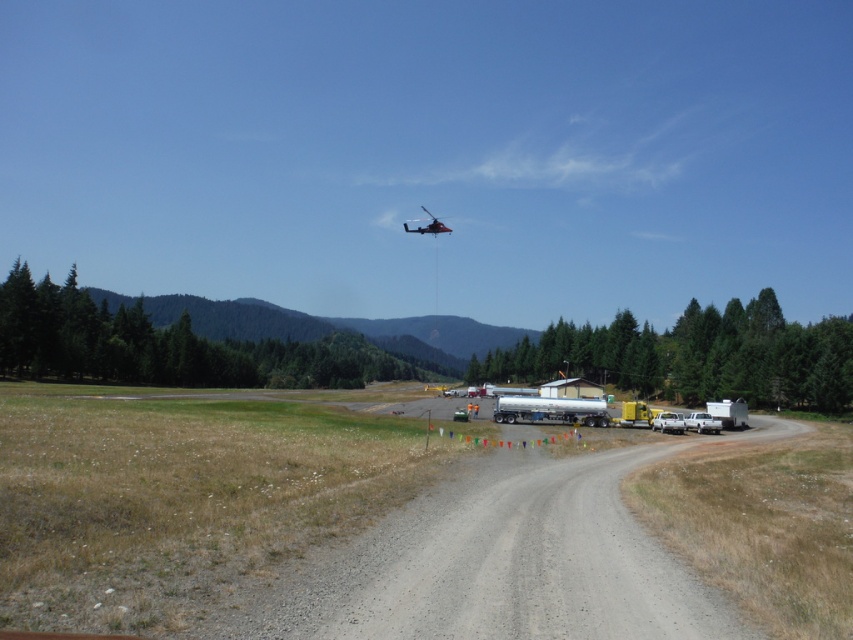
Question: Which of the following is the farthest from the observer?

Choices:
 (A) silver metallic trailer truck at center
 (B) gray gravel road at center
 (C) metallic red helicopter at upper center

Answer: (C)

Question: Can you confirm if silver metallic trailer truck at center is positioned below metallic red helicopter at upper center?

Choices:
 (A) no
 (B) yes

Answer: (B)

Question: Which of the following is the farthest from the observer?

Choices:
 (A) (474, 529)
 (B) (426, 230)
 (C) (508, 419)

Answer: (B)

Question: Which point is closer to the camera?

Choices:
 (A) silver metallic trailer truck at center
 (B) gray gravel road at center

Answer: (B)

Question: Is gray gravel road at center thinner than silver metallic trailer truck at center?

Choices:
 (A) yes
 (B) no

Answer: (B)

Question: Does gray gravel road at center have a lesser width compared to silver metallic trailer truck at center?

Choices:
 (A) no
 (B) yes

Answer: (A)